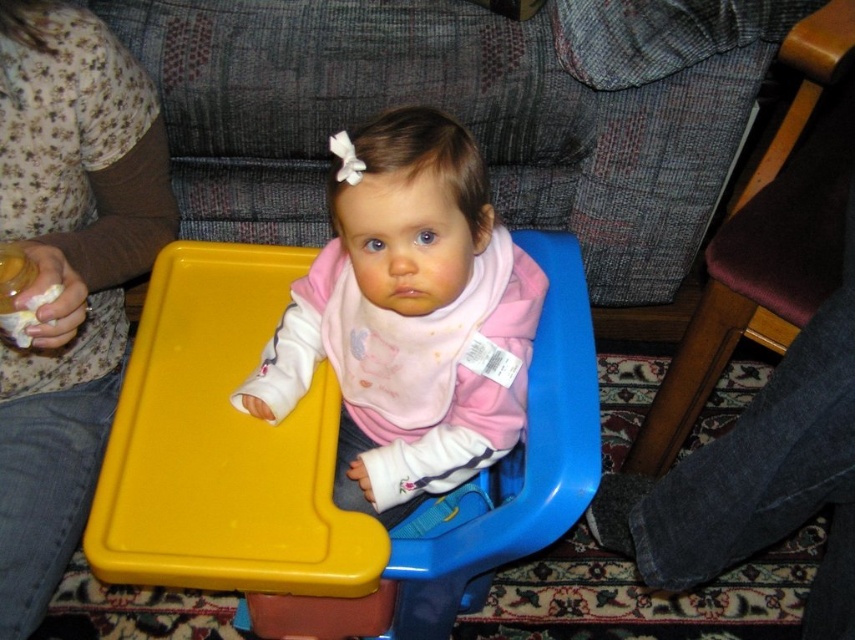
You are a parent trying to decide whether to place a small toy between the pink matte bib at center and the wooden chair at right. Based on the image, can the toy fit between them if the toy requires at least 1 cm of space?

The pink matte bib at center is thinner than the wooden chair at right, but the exact distance between them isn

You are a parent trying to locate your child in the high chair. You remember the pink matte bib at center was placed exactly at point coordinates 0.497, 0.480. Can you confirm if the bib is still in that position?

The pink matte bib at center is indeed positioned at point coordinates (423, 307), so yes, it remains in the exact location you remember.

You are a parent trying to locate your child in a room. You see the point marked at coordinates (410, 317). Where is this point located?

The point at (410, 317) is on the pink matte bib at center.